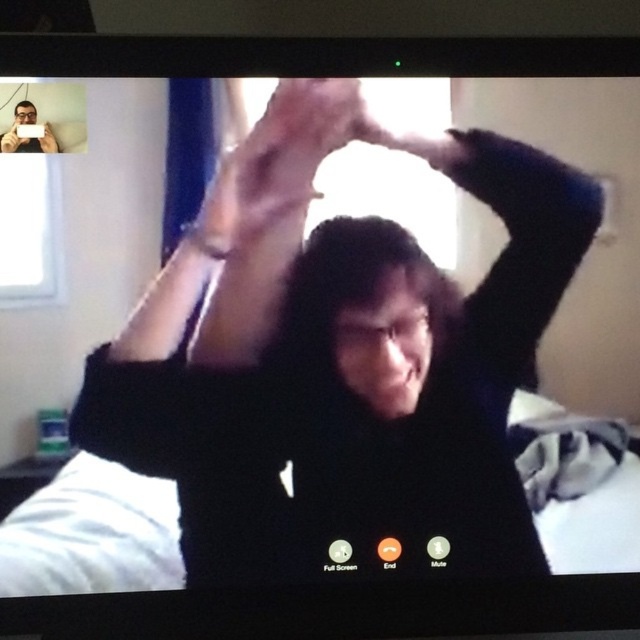
Question: Does matte black hair at center have a lesser width compared to matte black phone at upper left?

Choices:
 (A) no
 (B) yes

Answer: (A)

Question: Which of these objects is positioned closest to the black matte shirt at center?

Choices:
 (A) smooth skin hand at center
 (B) matte black hair at upper center

Answer: (A)

Question: Estimate the real-world distances between objects in this image. Which object is closer to the matte black phone at upper left?

Choices:
 (A) matte black hair at center
 (B) black matte shirt at center

Answer: (A)

Question: Does matte black phone at upper left have a larger size compared to matte black hair at upper center?

Choices:
 (A) yes
 (B) no

Answer: (A)

Question: Which of the following is the farthest from the observer?

Choices:
 (A) (28, 102)
 (B) (349, 216)
 (C) (13, 122)
 (D) (337, 115)

Answer: (B)

Question: Observing the image, what is the correct spatial positioning of matte black hair at center in reference to matte black phone at upper left?

Choices:
 (A) right
 (B) left

Answer: (A)